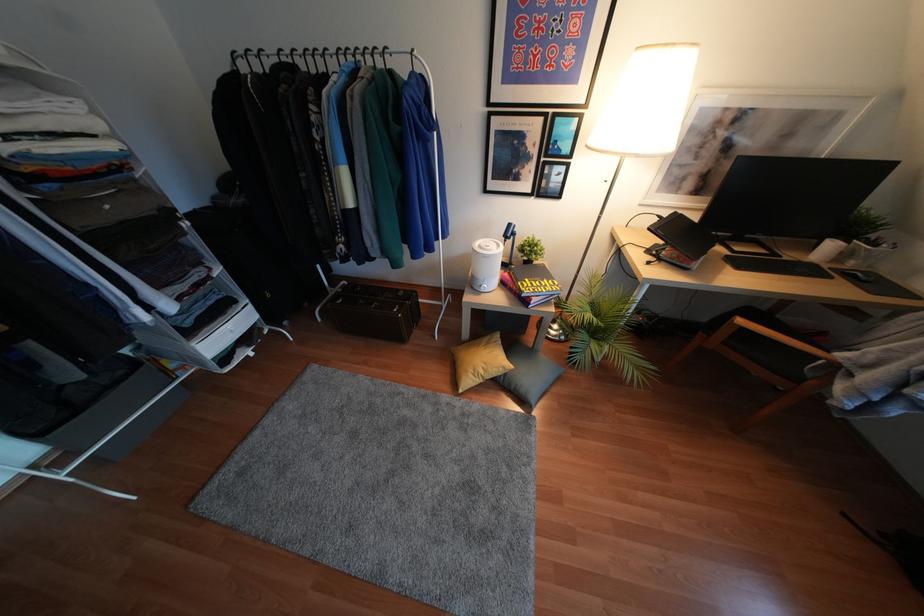
This screenshot has height=616, width=924. I want to click on red photography book, so click(x=530, y=283).